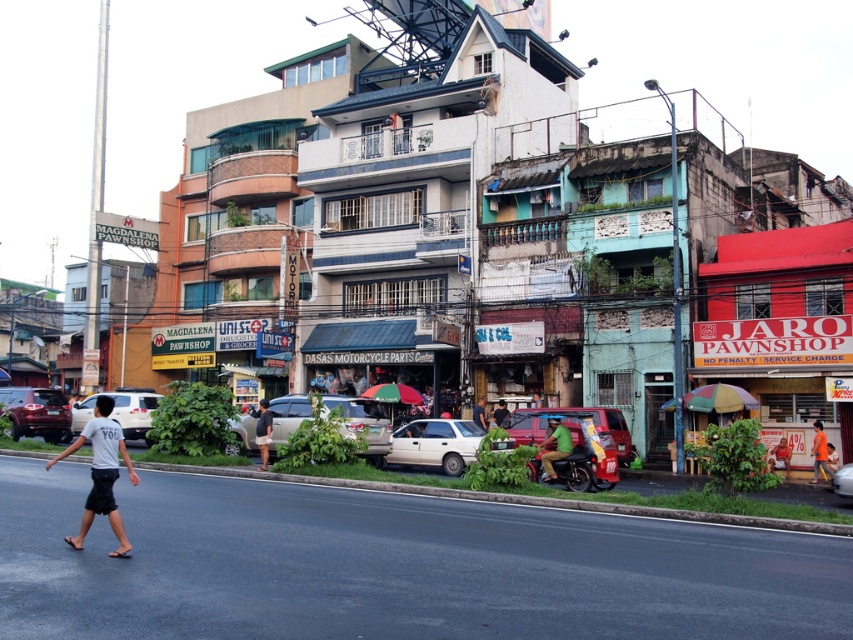
Question: Is white matte sedan at center to the left of orange fabric person at center from the viewer's perspective?

Choices:
 (A) no
 (B) yes

Answer: (B)

Question: Among these objects, which one is farthest from the camera?

Choices:
 (A) white matte van at center
 (B) red matte pawnshop at right

Answer: (B)

Question: Which of these objects is positioned closest to the metallic red van at center?

Choices:
 (A) matte silver car at center
 (B) red matte pawnshop at right
 (C) orange fabric person at center
 (D) matte red suv at center

Answer: (B)

Question: Estimate the real-world distances between objects in this image. Which object is closer to the dark gray shorts at center?

Choices:
 (A) red matte pawnshop at right
 (B) orange fabric person at center

Answer: (B)

Question: Is orange fabric person at center thinner than dark green shirt at center?

Choices:
 (A) yes
 (B) no

Answer: (A)

Question: Is green matte shirt at center wider than dark green shirt at center?

Choices:
 (A) no
 (B) yes

Answer: (B)